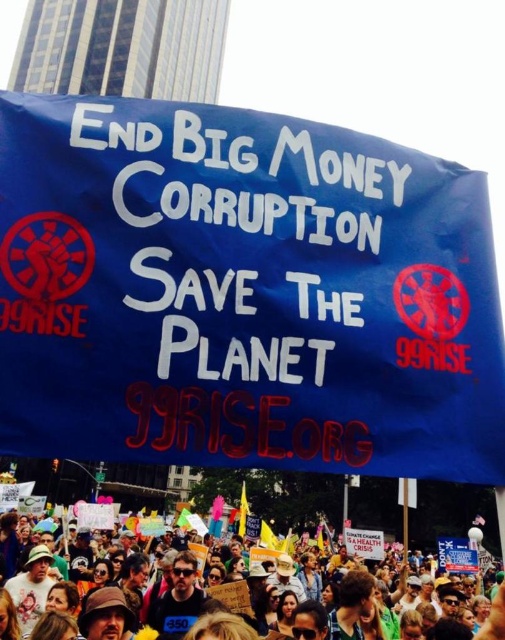
You are a photographer trying to capture the protest scene. You want to ensure both the blue fabric banner at center and the blue fabric crowd at lower center are visible in your shot. Given their sizes, which object should you focus on to frame the photo properly?

The blue fabric banner at center is smaller than the blue fabric crowd at lower center. To frame the photo properly, focus on the blue fabric crowd at lower center since it is larger and will occupy more space in the frame, ensuring both elements are visible.

You are a photographer trying to capture the entire protest scene. You notice the blue fabric banner at center and the blue fabric crowd at lower center. Which one appears narrower in the photo?

The blue fabric banner at center appears narrower because its width is less than the blue fabric crowd at lower center.